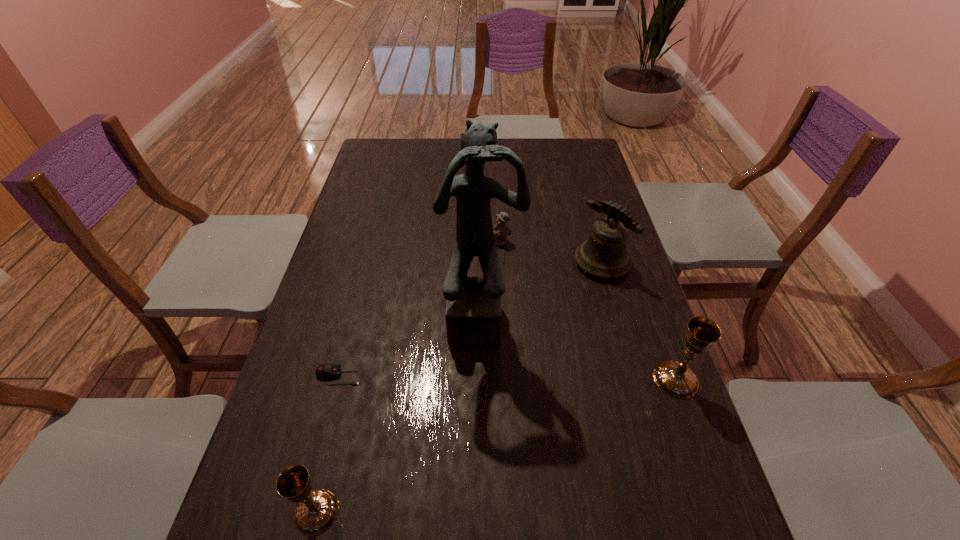
You are a GUI agent. You are given a task and a screenshot of the screen. Output one action in this format:
    pyautogui.click(x=<x>, y=<y>)
    Task: Click on the free point located on the left of the right chalice
    This screenshot has width=960, height=540.
    Given the screenshot: What is the action you would take?
    pyautogui.click(x=525, y=380)

This screenshot has height=540, width=960. Find the location of `free space located on the front-facing side of the teddy bear`. free space located on the front-facing side of the teddy bear is located at coordinates (503, 275).

This screenshot has height=540, width=960. Find the location of `vacant space situated on the front of the bell`. vacant space situated on the front of the bell is located at coordinates (642, 402).

You are a GUI agent. You are given a task and a screenshot of the screen. Output one action in this format:
    pyautogui.click(x=<x>, y=<y>)
    Task: Click on the blank area located 0.210m on the right of the shortest object
    
    Given the screenshot: What is the action you would take?
    pyautogui.click(x=450, y=376)

The height and width of the screenshot is (540, 960). I want to click on free space located on the face of the third farthest object, so click(482, 516).

Locate an element on the screen. object that is at the near edge is located at coordinates (316, 511).

Identify the location of chalice located in the left edge section of the desktop. (316, 511).

The image size is (960, 540). Find the location of `mouse that is positioned at the left edge`. mouse that is positioned at the left edge is located at coordinates (325, 371).

Identify the location of chalice that is at the right edge. The width and height of the screenshot is (960, 540). (675, 378).

Where is `bell located at the right edge`? This screenshot has width=960, height=540. bell located at the right edge is located at coordinates (604, 254).